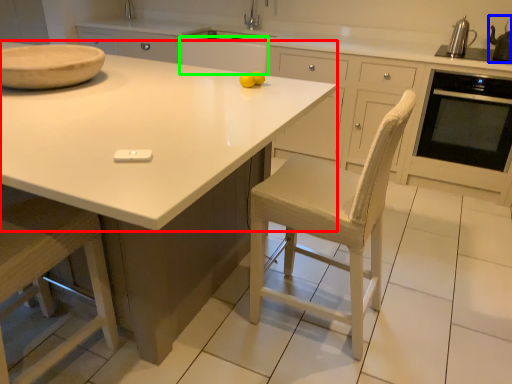
Question: Based on their relative distances, which object is farther from countertop (highlighted by a red box)? Choose from appliance (highlighted by a blue box) and cabinetry (highlighted by a green box).

Choices:
 (A) appliance
 (B) cabinetry

Answer: (A)